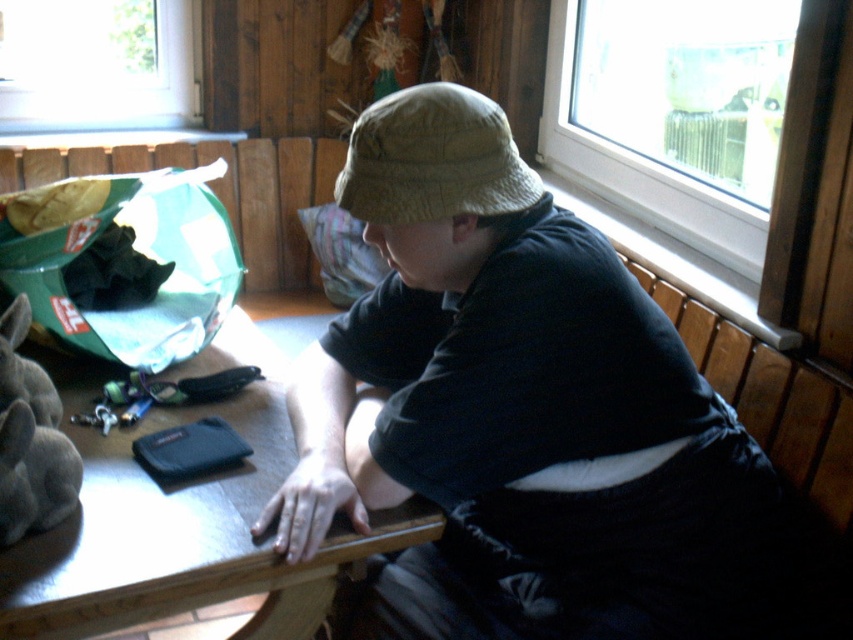
You are a delivery person who needs to place a new package on the table. The package is 20 cm tall. Can you place it on the wooden table at center without it touching the matte khaki bucket hat at center?

The matte khaki bucket hat at center has a greater height compared to wooden table at center. Since the package is 20 cm tall, and the table is shorter than the hat, placing the package might cause it to touch the hat if not positioned carefully. However, the exact dimensions of the table and hat are not provided, so it depends on the available space around the hat.

You are organizing a small party and need to place a large centerpiece on the table. Given the current items on the wooden table at center, including the matte khaki bucket hat at center, do you think there is enough space to accommodate the centerpiece?

The wooden table at center is larger than the matte khaki bucket hat at center, so there might be enough space to place a large centerpiece. However, the current items on the table should be moved or rearranged to make room for the centerpiece.

You are a photographer trying to capture the matte khaki bucket hat at center and the transparent glass window at upper right in a single frame. Since the window is letting in a lot of light, will the bucket hat be visible in the photo?

The matte khaki bucket hat at center is in front of transparent glass window at upper right, so it may block some of the light coming through the window. However, since the window is transparent, the hat might still be visible through the window, but its visibility could depend on the lighting conditions and the camera settings used. To ensure the hat is visible, adjust the exposure or use a reflector to balance the light.